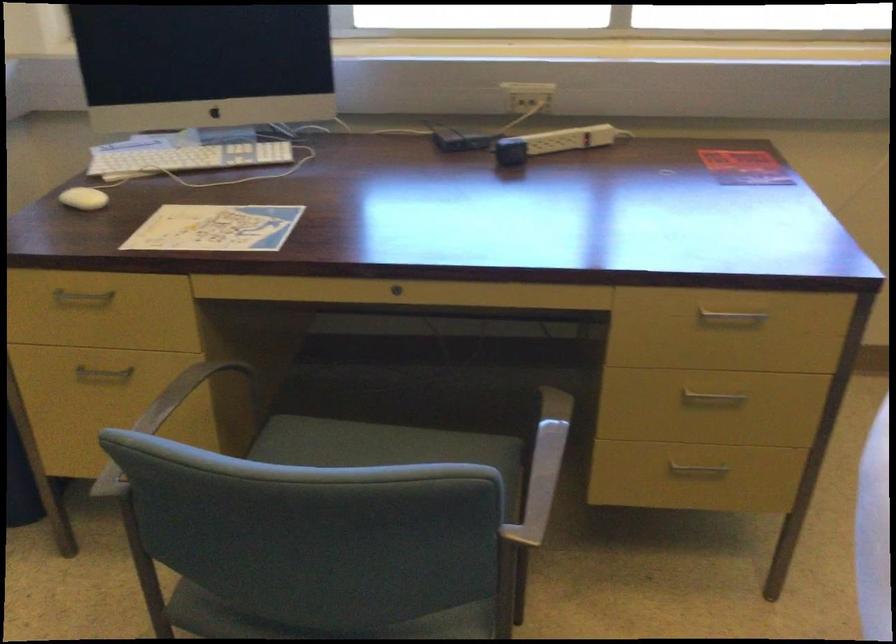
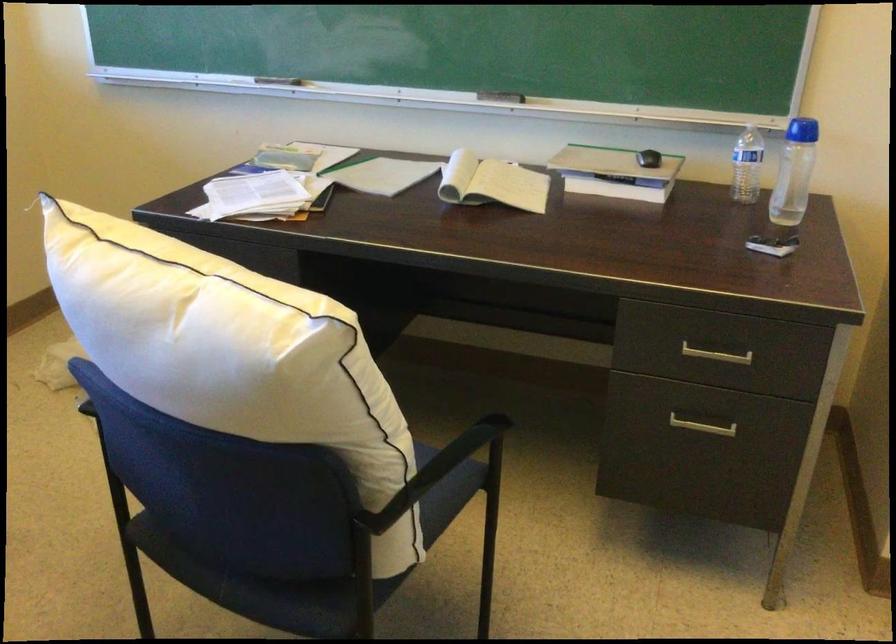
Question: The camera is either moving clockwise (left) or counter-clockwise (right) around the object. The first image is from the beginning of the video and the second image is from the end. Is the camera moving left or right when shooting the video?

Choices:
 (A) Left
 (B) Right

Answer: (A)